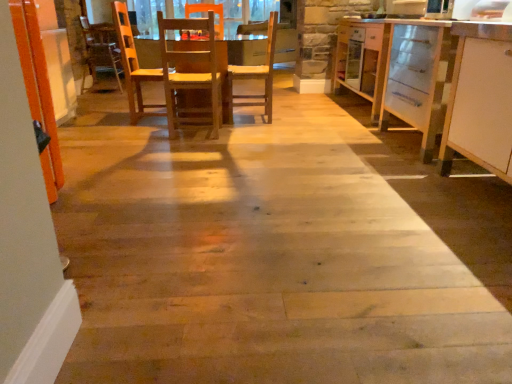
Question: Is white matte cabinet at right wider than wooden chair at center, the 2th chair in the left-to-right sequence?

Choices:
 (A) no
 (B) yes

Answer: (B)

Question: Is white matte cabinet at right positioned with its back to wooden chair at center, which is counted as the 1th chair, starting from the right?

Choices:
 (A) yes
 (B) no

Answer: (B)

Question: Is white matte cabinet at right thinner than wooden chair at center, which is counted as the 1th chair, starting from the right?

Choices:
 (A) yes
 (B) no

Answer: (B)

Question: Is white matte cabinet at right to the left of wooden chair at center, the 2th chair in the left-to-right sequence, from the viewer's perspective?

Choices:
 (A) no
 (B) yes

Answer: (A)

Question: Is white matte cabinet at right aimed at wooden chair at center, the 2th chair in the left-to-right sequence?

Choices:
 (A) no
 (B) yes

Answer: (A)

Question: Considering the relative positions of white matte cabinet at right and wooden chair at center, the 2th chair in the left-to-right sequence, in the image provided, is white matte cabinet at right to the right of wooden chair at center, the 2th chair in the left-to-right sequence, from the viewer's perspective?

Choices:
 (A) yes
 (B) no

Answer: (A)

Question: From a real-world perspective, is white matte cabinet at right physically above wooden table at center?

Choices:
 (A) no
 (B) yes

Answer: (B)

Question: From the image's perspective, does white matte cabinet at right appear higher than wooden table at center?

Choices:
 (A) yes
 (B) no

Answer: (B)

Question: Is white matte cabinet at right far away from wooden table at center?

Choices:
 (A) no
 (B) yes

Answer: (B)

Question: Considering the relative sizes of white matte cabinet at right and wooden table at center in the image provided, is white matte cabinet at right shorter than wooden table at center?

Choices:
 (A) yes
 (B) no

Answer: (B)

Question: Does white matte cabinet at right lie behind wooden table at center?

Choices:
 (A) no
 (B) yes

Answer: (A)

Question: Is white matte cabinet at right thinner than wooden table at center?

Choices:
 (A) yes
 (B) no

Answer: (A)

Question: Is wooden chair at center, the second chair from the right, taller than white matte cabinet at right?

Choices:
 (A) no
 (B) yes

Answer: (A)